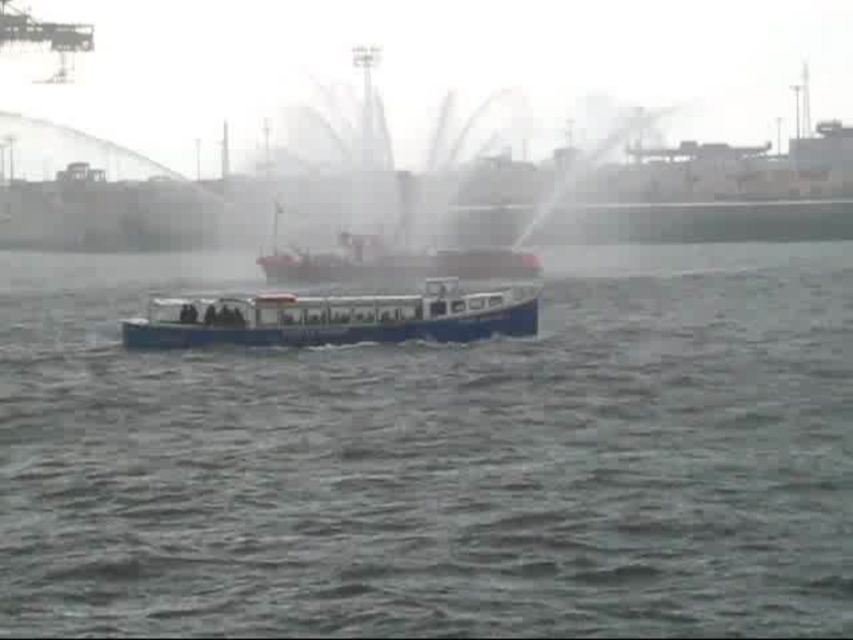
Looking at this image, is blue matte water at center above white plastic boat at center?

No.

Is blue matte water at center positioned at the back of white plastic boat at center?

No, blue matte water at center is in front of white plastic boat at center.

Between point (548, 570) and point (215, 301), which one is positioned in front?

Point (548, 570) is more forward.

Locate an element on the screen. blue matte water at center is located at coordinates (438, 458).